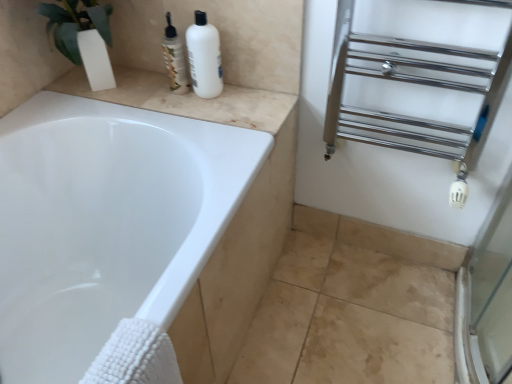
At what (x,y) coordinates should I click in order to perform the action: click on free space that is to the left of translucent plastic bottles at upper center. Please return your answer as a coordinate pair (x, y). This screenshot has height=384, width=512. Looking at the image, I should click on (136, 87).